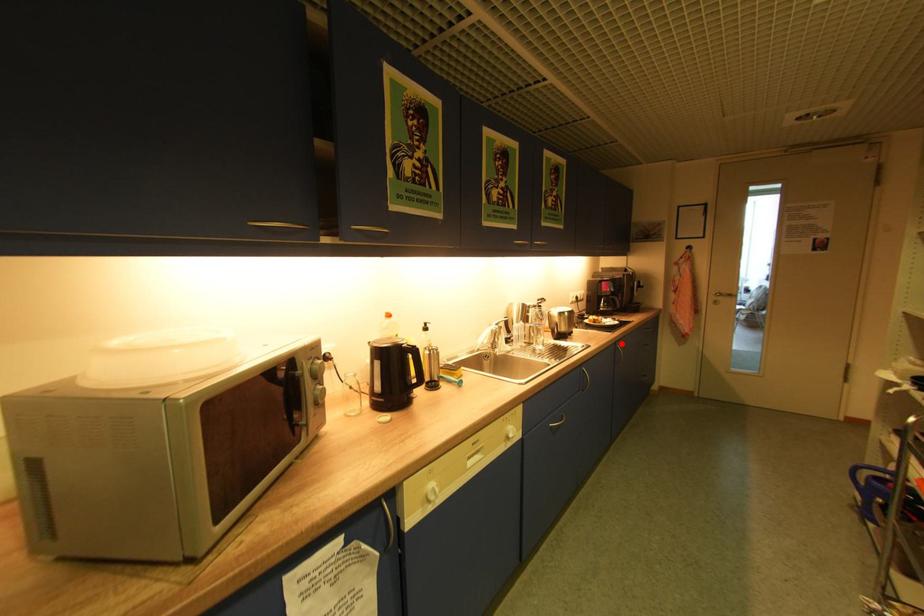
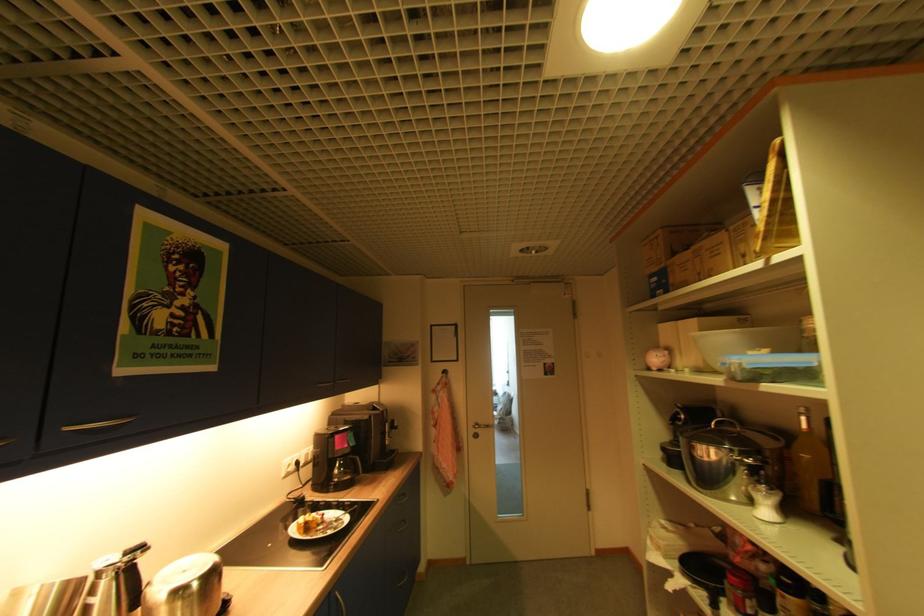
Question: I am providing you with two images of the same scene from different viewpoints. A red point is marked on the first image. At the location where the point appears in image 1, is it still visible in image 2?

Choices:
 (A) Yes
 (B) No

Answer: (A)